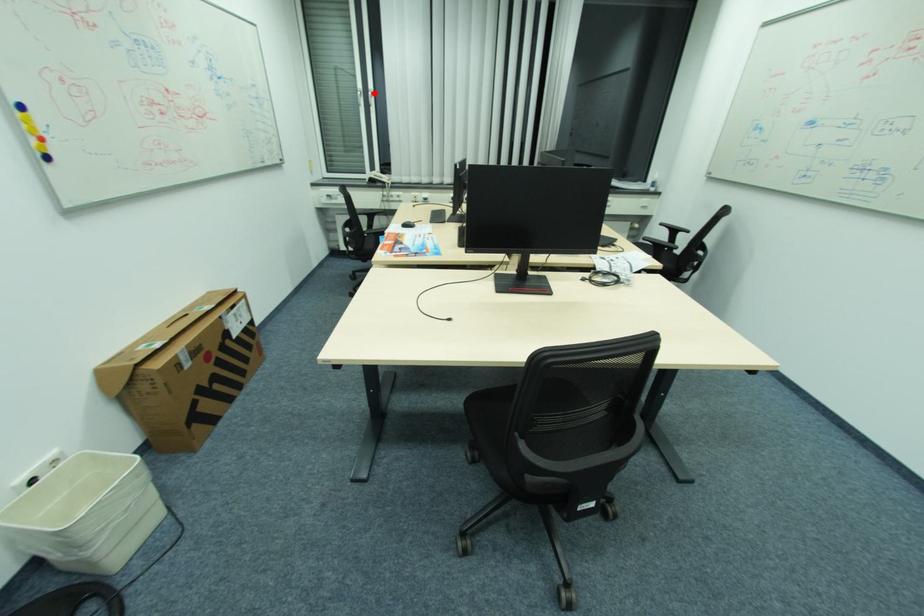
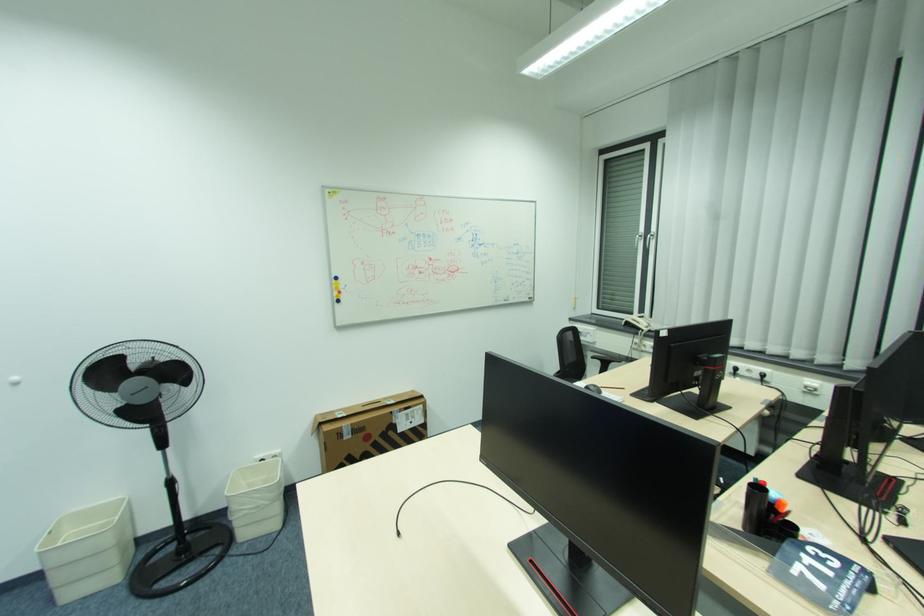
Find the pixel in the second image that matches the highlighted location in the first image.

(653, 236)